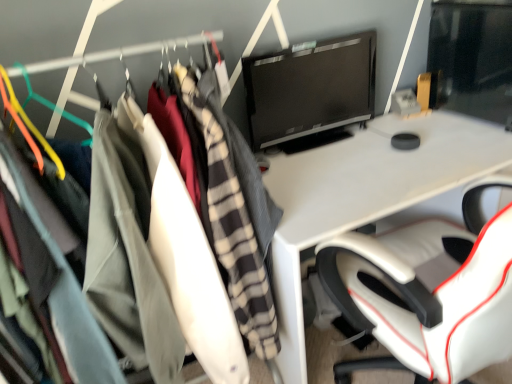
Question: Is point (173, 286) positioned closer to the camera than point (352, 54)?

Choices:
 (A) farther
 (B) closer

Answer: (B)

Question: Is light gray fabric coat at left to the left or to the right of black glossy monitor at upper right in the image?

Choices:
 (A) left
 (B) right

Answer: (A)

Question: Considering the positions of light gray fabric coat at left and black glossy monitor at upper right in the image, is light gray fabric coat at left taller or shorter than black glossy monitor at upper right?

Choices:
 (A) tall
 (B) short

Answer: (A)

Question: Relative to light gray fabric coat at left, is black glossy monitor at upper right in front or behind?

Choices:
 (A) behind
 (B) front

Answer: (A)

Question: Is black glossy monitor at upper right taller or shorter than light gray fabric coat at left?

Choices:
 (A) tall
 (B) short

Answer: (B)

Question: Looking at their shapes, would you say black glossy monitor at upper right is wider or thinner than light gray fabric coat at left?

Choices:
 (A) wide
 (B) thin

Answer: (B)

Question: Considering the positions of point (343, 97) and point (222, 153), is point (343, 97) closer or farther from the camera than point (222, 153)?

Choices:
 (A) closer
 (B) farther

Answer: (B)